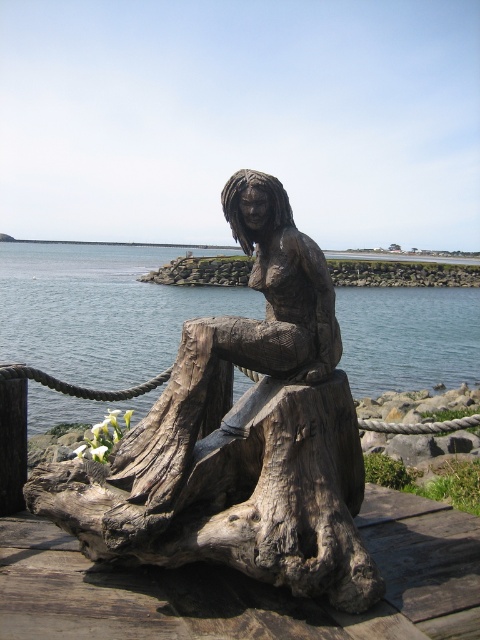
Question: Is wooden statue at center below clear blue water at center?

Choices:
 (A) no
 (B) yes

Answer: (B)

Question: Among these points, which one is farthest from the camera?

Choices:
 (A) (204, 424)
 (B) (62, 365)

Answer: (B)

Question: Does wooden statue at center have a smaller size compared to clear blue water at center?

Choices:
 (A) no
 (B) yes

Answer: (B)

Question: Among these objects, which one is nearest to the camera?

Choices:
 (A) clear blue water at center
 (B) wooden statue at center

Answer: (B)

Question: Can you confirm if wooden statue at center is positioned to the right of clear blue water at center?

Choices:
 (A) yes
 (B) no

Answer: (B)

Question: Which of the following is the farthest from the observer?

Choices:
 (A) clear blue water at center
 (B) wooden statue at center

Answer: (A)